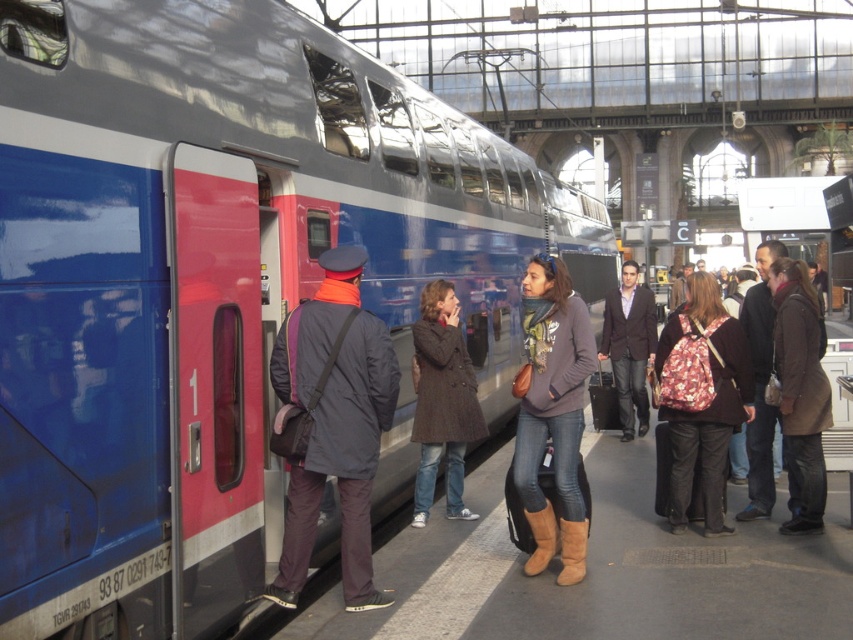
Question: Does dark gray coat at center appear under dark brown leather jacket at center?

Choices:
 (A) no
 (B) yes

Answer: (A)

Question: Among these objects, which one is nearest to the camera?

Choices:
 (A) brown leather jacket at center
 (B) brown suede boots at center
 (C) metallic blue train at center
 (D) dark gray coat at center

Answer: (C)

Question: Considering the real-world distances, which object is closest to the dark gray coat at center?

Choices:
 (A) metallic blue train at center
 (B) brown leather jacket at center
 (C) floral fabric backpack at center-right
 (D) dark brown leather jacket at center

Answer: (A)

Question: From the image, what is the correct spatial relationship of floral fabric backpack at center-right in relation to brown wool coat at center?

Choices:
 (A) left
 (B) right

Answer: (B)

Question: Which of the following is the farthest from the observer?

Choices:
 (A) (264, 497)
 (B) (604, 356)
 (C) (738, 371)
 (D) (454, 301)

Answer: (B)

Question: Can you confirm if metallic blue train at center is positioned to the left of dark gray coat at center?

Choices:
 (A) no
 (B) yes

Answer: (A)